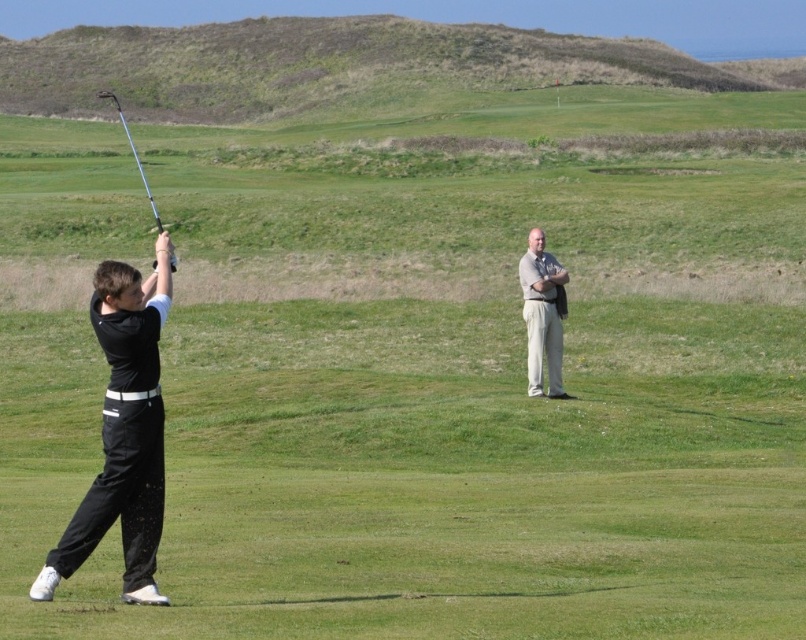
Does light beige pants at center appear under metallic silver golf club at left?

Yes, light beige pants at center is below metallic silver golf club at left.

Can you confirm if light beige pants at center is wider than metallic silver golf club at left?

No.

Does point (559, 269) come behind point (139, 173)?

No, it is not.

Find the location of a particular element. light beige pants at center is located at coordinates (542, 316).

Who is more distant from viewer, (139, 380) or (143, 177)?

Point (143, 177)

This screenshot has width=806, height=640. What are the coordinates of `black matte pants at left` in the screenshot? It's located at (123, 432).

Between point (57, 561) and point (526, 358), which one is positioned behind?

The point (526, 358) is behind.

Between black matte pants at left and light beige pants at center, which one has more height?

black matte pants at left is taller.

Does point (129, 308) come behind point (541, 342)?

No, it is in front of (541, 342).

Locate an element on the screen. black matte pants at left is located at coordinates (123, 432).